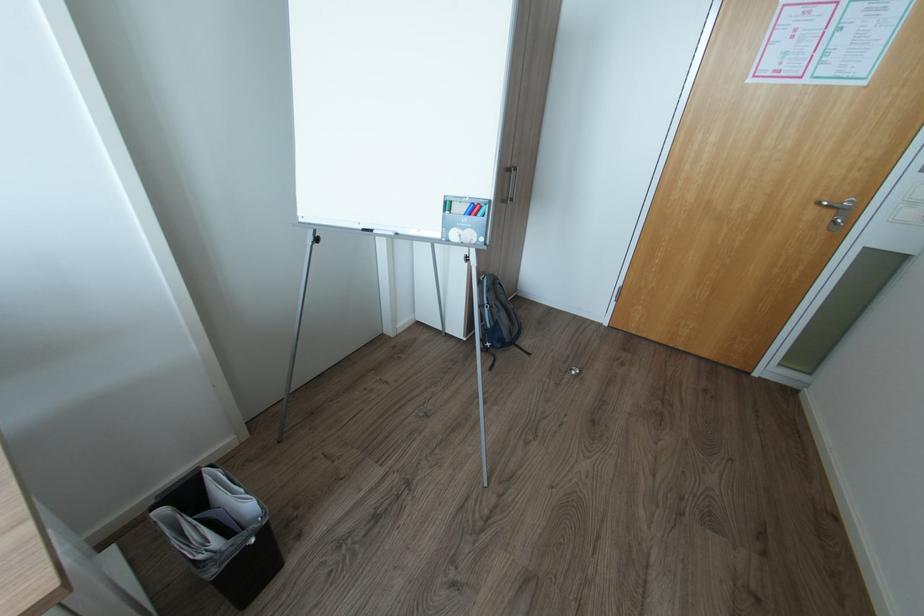
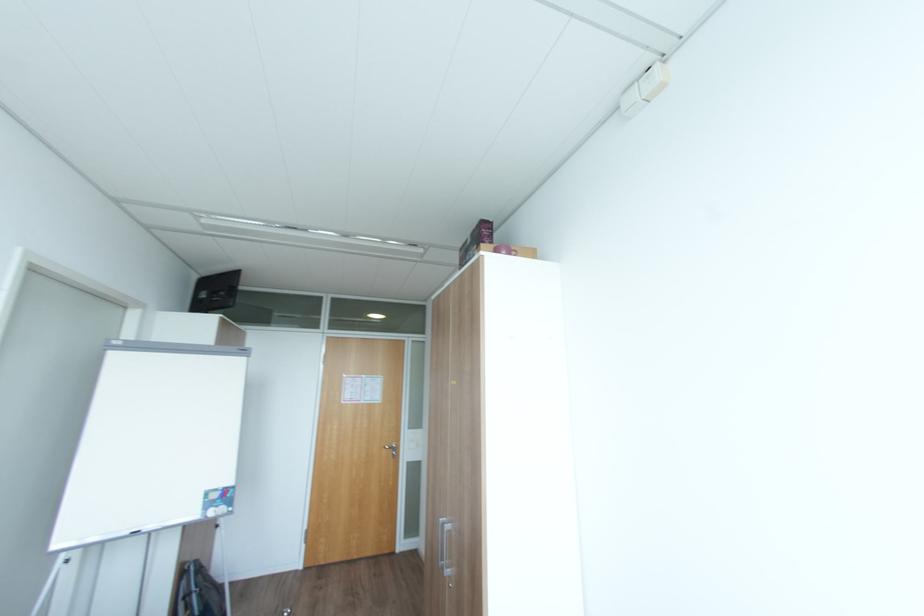
Locate, in the second image, the point that corresponds to point (830, 204) in the first image.

(392, 448)